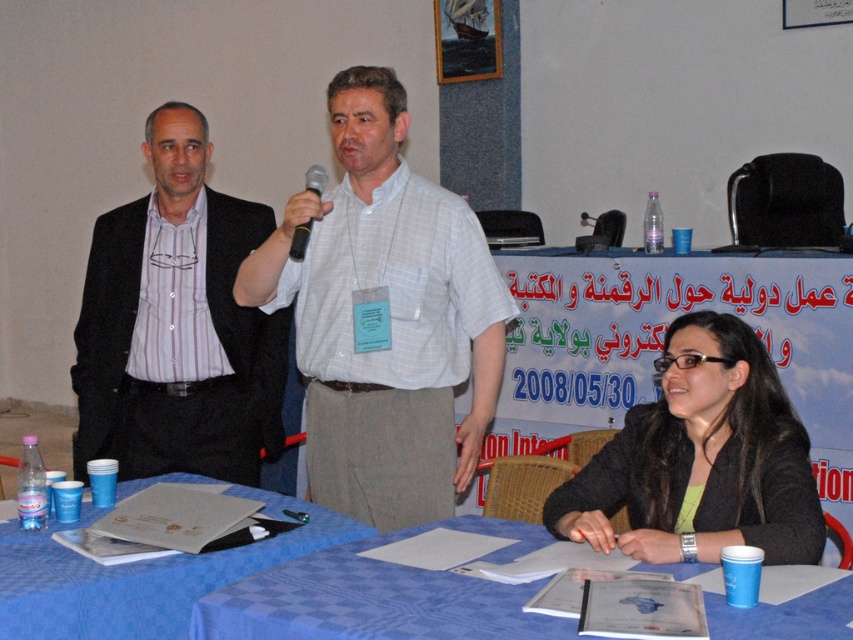
What is the position of the point labeled as point (177, 324) in relation to the seated woman?

The point labeled as point (177, 324) is located on the matte black suit at left.

You are standing in the conference room and want to find the matte black suit at left. According to the coordinates provided, where should you look?

The matte black suit at left is located at the 2D coordinates point (x=177, y=324).

You are a guest at the event and need to place your name tag on the blue fabric table at lower center. To do so, should you walk around the matte black suit at left or go directly to the table?

The blue fabric table at lower center is behind the matte black suit at left, so you should walk around the matte black suit at left to access the table.